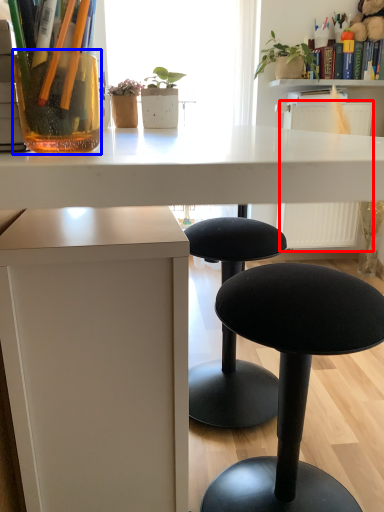
Question: Which object is further to the camera taking this photo, radiator (highlighted by a red box) or vase (highlighted by a blue box)?

Choices:
 (A) radiator
 (B) vase

Answer: (A)